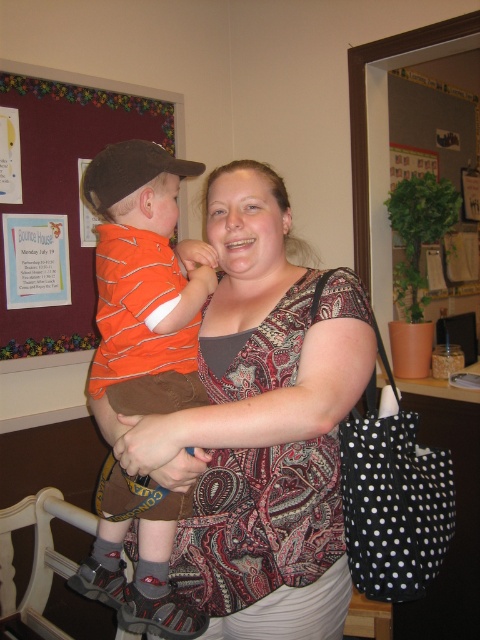
You are standing in the room and want to move from point (165, 168) to point (34, 561). Which direction should you face to walk towards the farther point?

You should face away from the viewer because point (34, 561) is farther from the viewer compared to point (165, 168).